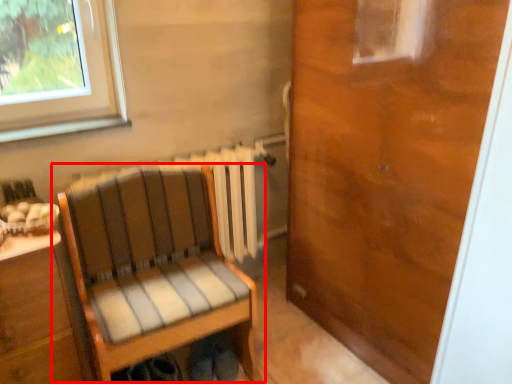
Question: From the image's perspective, what is the correct spatial positioning of chair (annotated by the red box) in reference to door?

Choices:
 (A) below
 (B) above

Answer: (A)